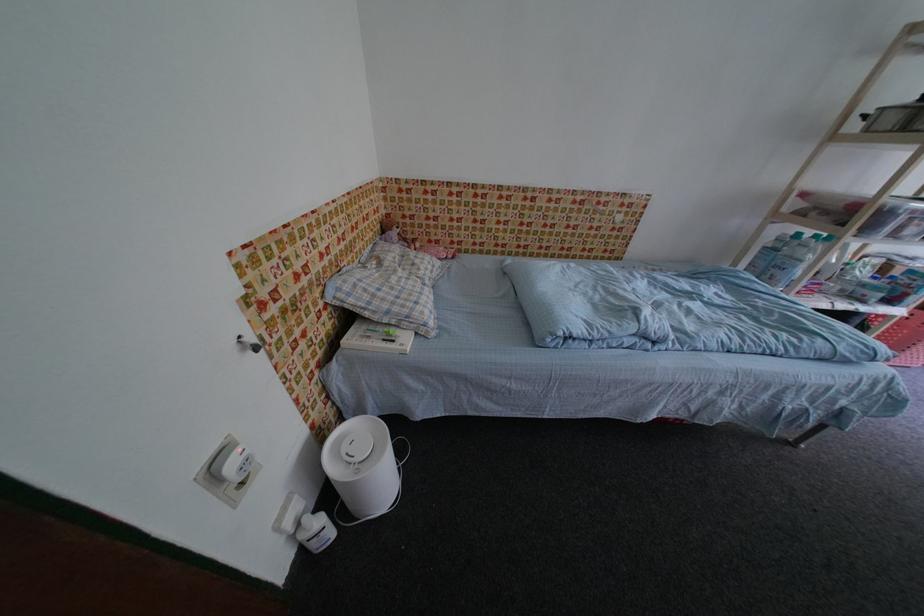
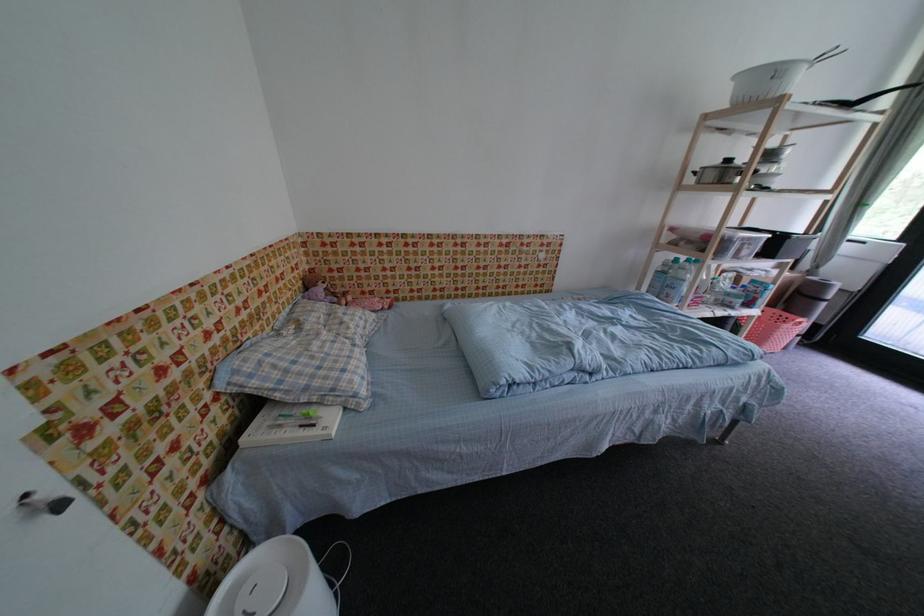
Question: The camera is either moving clockwise (left) or counter-clockwise (right) around the object. The first image is from the beginning of the video and the second image is from the end. Is the camera moving left or right when shooting the video?

Choices:
 (A) Left
 (B) Right

Answer: (A)